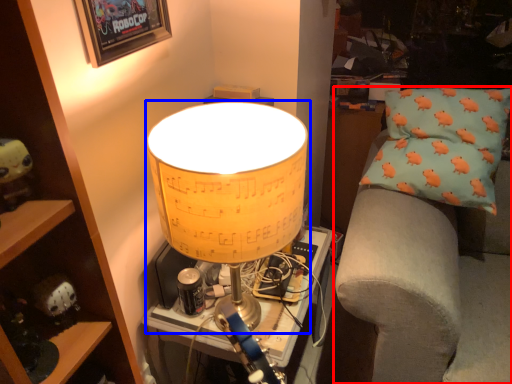
Question: Which object is closer to the camera taking this photo, furniture (highlighted by a red box) or lamp (highlighted by a blue box)?

Choices:
 (A) furniture
 (B) lamp

Answer: (B)